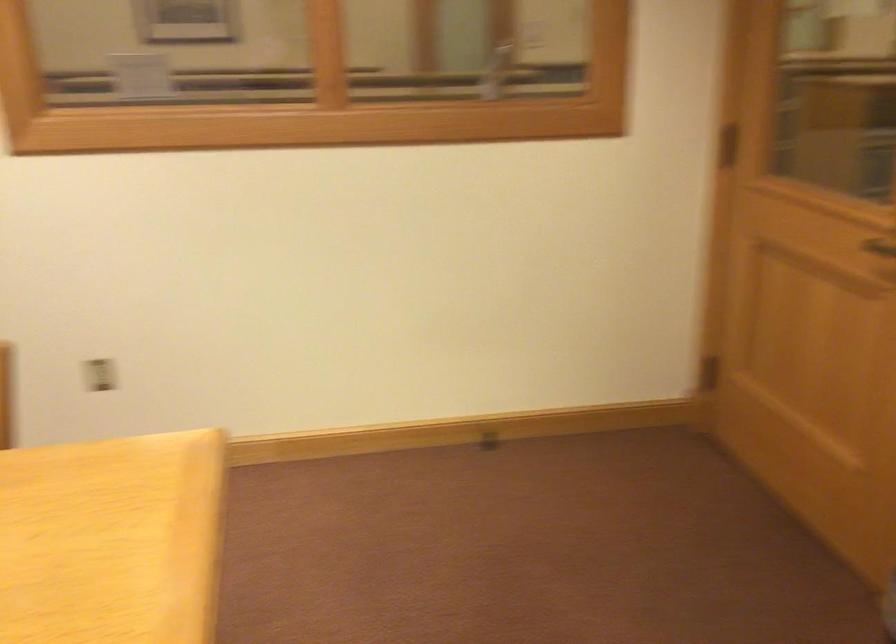
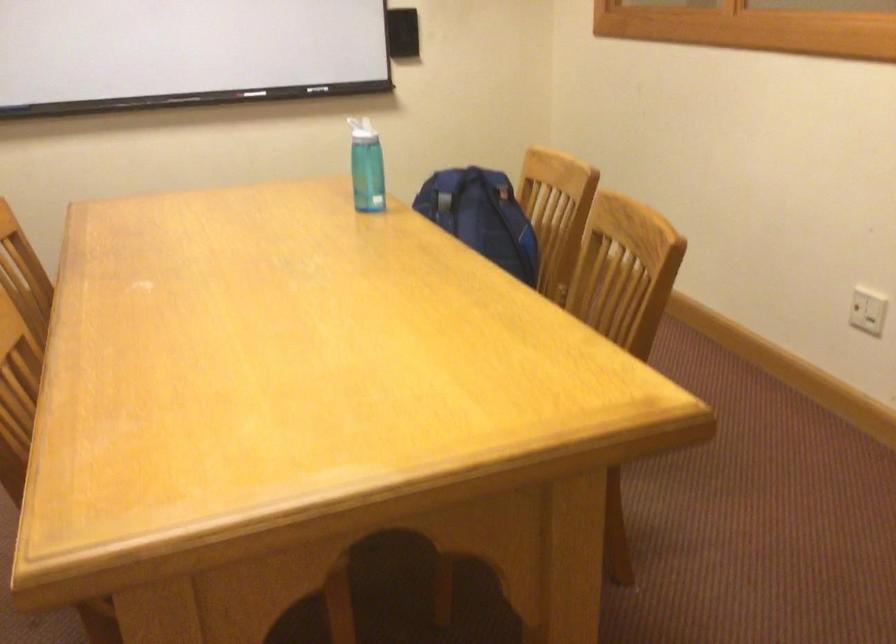
In the scene shown: First-person continuous shooting, in which direction is the camera rotating?

The camera's rotation is toward left-down.